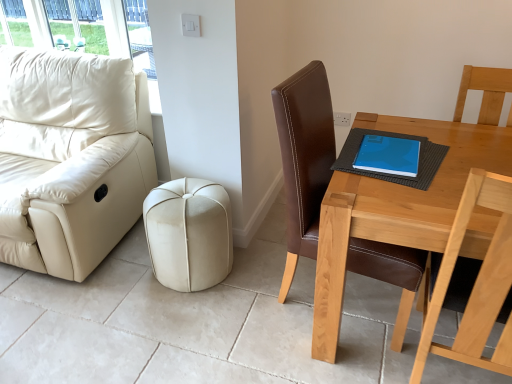
Question: Is light brown wooden table at right turned away from brown leather chair at right?

Choices:
 (A) no
 (B) yes

Answer: (B)

Question: Is light brown wooden table at right wider than brown leather chair at right?

Choices:
 (A) yes
 (B) no

Answer: (A)

Question: Is light brown wooden table at right shorter than brown leather chair at right?

Choices:
 (A) yes
 (B) no

Answer: (A)

Question: Is light brown wooden table at right beside brown leather chair at right?

Choices:
 (A) no
 (B) yes

Answer: (A)

Question: Does light brown wooden table at right have a lesser width compared to brown leather chair at right?

Choices:
 (A) yes
 (B) no

Answer: (B)

Question: In terms of height, does beige leather ottoman at center look taller or shorter compared to brown leather chair at right?

Choices:
 (A) tall
 (B) short

Answer: (B)

Question: Is point (225, 273) positioned closer to the camera than point (293, 135)?

Choices:
 (A) farther
 (B) closer

Answer: (A)

Question: From the image's perspective, is beige leather ottoman at center positioned above or below brown leather chair at right?

Choices:
 (A) below
 (B) above

Answer: (A)

Question: From a real-world perspective, is beige leather ottoman at center physically located above or below brown leather chair at right?

Choices:
 (A) below
 (B) above

Answer: (A)

Question: Is blue matte book at upper right spatially inside light brown wooden table at right, or outside of it?

Choices:
 (A) inside
 (B) outside

Answer: (B)

Question: From the image's perspective, relative to light brown wooden table at right, is blue matte book at upper right above or below?

Choices:
 (A) above
 (B) below

Answer: (A)

Question: Considering the positions of point (357, 163) and point (379, 206), is point (357, 163) closer or farther from the camera than point (379, 206)?

Choices:
 (A) closer
 (B) farther

Answer: (B)

Question: Relative to light brown wooden table at right, is blue matte book at upper right in front or behind?

Choices:
 (A) behind
 (B) front

Answer: (A)

Question: Is blue matte book at upper right to the left or to the right of brown leather chair at right in the image?

Choices:
 (A) right
 (B) left

Answer: (A)

Question: Do you think blue matte book at upper right is within brown leather chair at right, or outside of it?

Choices:
 (A) outside
 (B) inside

Answer: (B)